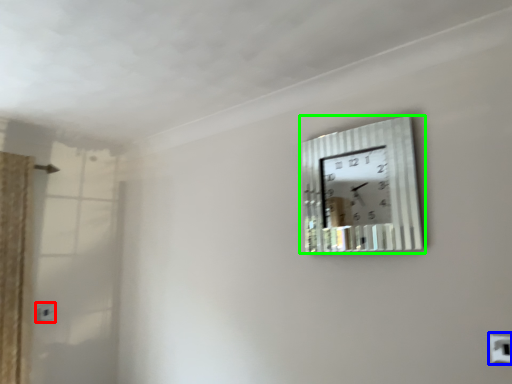
Question: Estimate the real-world distances between objects in this image. Which object is farther from electric outlet (highlighted by a red box), electric outlet (highlighted by a blue box) or wall clock (highlighted by a green box)?

Choices:
 (A) electric outlet
 (B) wall clock

Answer: (A)